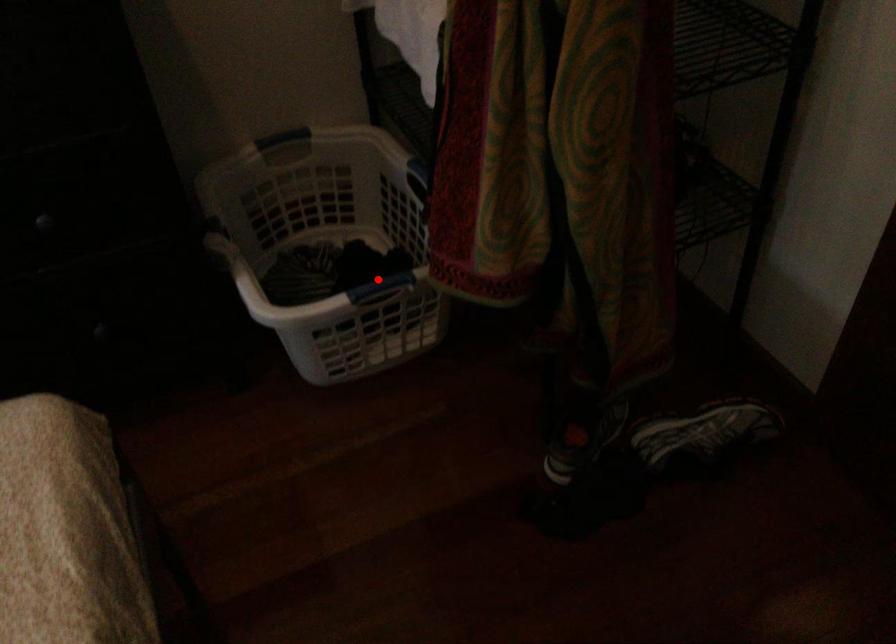
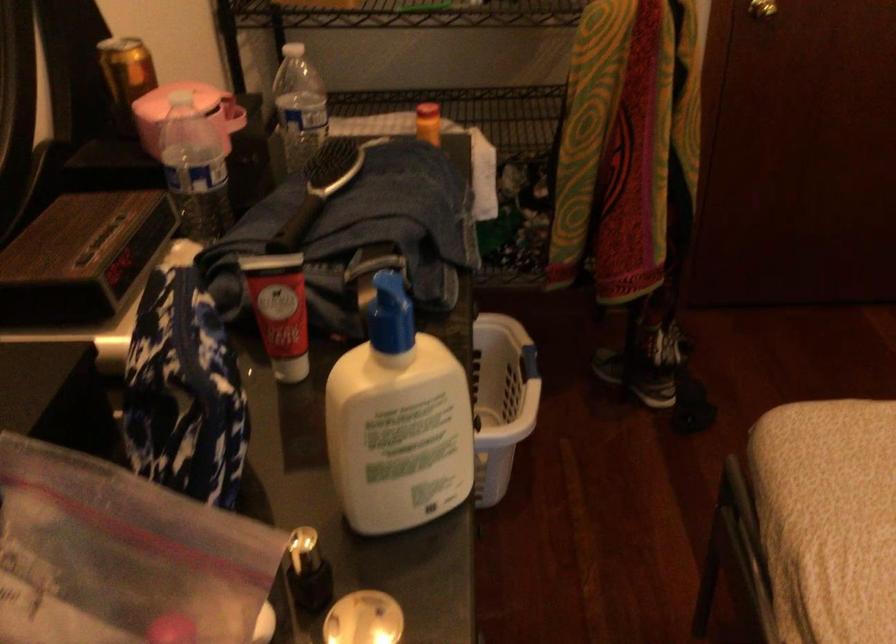
Where in the second image is the point corresponding to the highlighted location from the first image?

(529, 363)